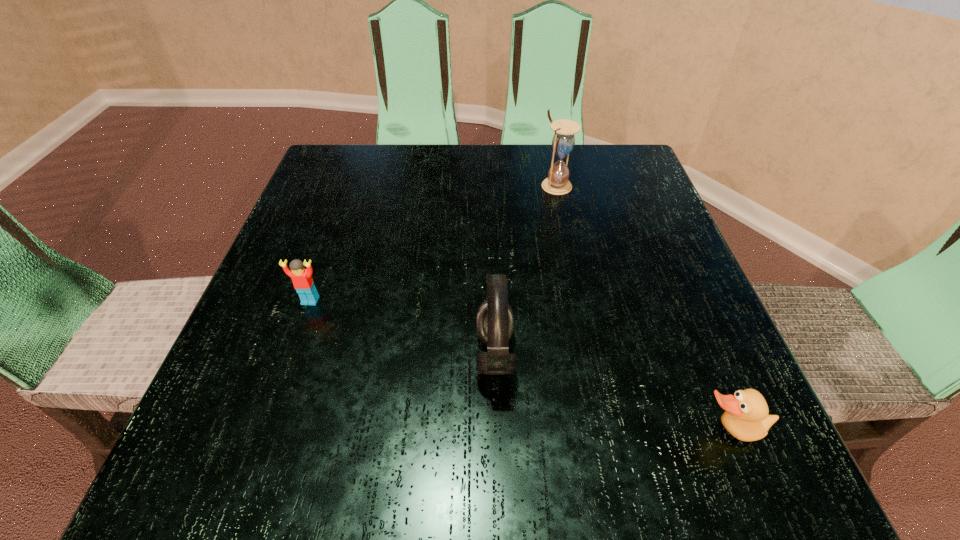
Identify the location of unoccupied area between the nearest object and the hourglass. (643, 308).

Where is `free space that is in between the third nearest object and the headset`? The image size is (960, 540). free space that is in between the third nearest object and the headset is located at coordinates [402, 328].

What are the coordinates of `empty space that is in between the hourglass and the rightmost object` in the screenshot? It's located at (643, 308).

Locate which object is the second closest to the leftmost object. Please provide its 2D coordinates. Your answer should be formatted as a tuple, i.e. [(x, y)], where the tuple contains the x and y coordinates of a point satisfying the conditions above.

[(563, 141)]

Where is `the third closest object to the farthest object`? the third closest object to the farthest object is located at coordinates (746, 417).

You are a GUI agent. You are given a task and a screenshot of the screen. Output one action in this format:
    pyautogui.click(x=<x>, y=<y>)
    Task: Click on the vacant space that satisfies the following two spatial constraints: 1. on the front side of the second object from right to left; 2. on the earcups of the headset
    
    Given the screenshot: What is the action you would take?
    pyautogui.click(x=592, y=355)